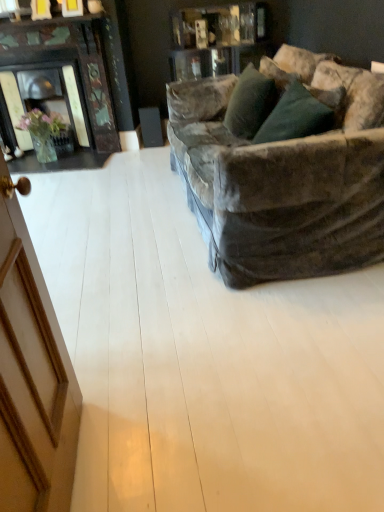
Question: Considering the relative sizes of velvet green pillow at upper right and light wood floor at center in the image provided, is velvet green pillow at upper right taller than light wood floor at center?

Choices:
 (A) yes
 (B) no

Answer: (A)

Question: Is velvet green pillow at upper right closer to camera compared to light wood floor at center?

Choices:
 (A) no
 (B) yes

Answer: (A)

Question: From the image's perspective, is velvet green pillow at upper right beneath light wood floor at center?

Choices:
 (A) yes
 (B) no

Answer: (B)

Question: Considering the relative sizes of velvet green pillow at upper right and light wood floor at center in the image provided, is velvet green pillow at upper right smaller than light wood floor at center?

Choices:
 (A) no
 (B) yes

Answer: (B)

Question: Does velvet green pillow at upper right have a lesser height compared to light wood floor at center?

Choices:
 (A) yes
 (B) no

Answer: (B)

Question: From the image's perspective, does velvet green pillow at upper right appear higher than light wood floor at center?

Choices:
 (A) yes
 (B) no

Answer: (A)

Question: Is light wood floor at center outside of velvet green pillow at upper right?

Choices:
 (A) yes
 (B) no

Answer: (A)

Question: Is light wood floor at center wider than velvet green pillow at upper right?

Choices:
 (A) no
 (B) yes

Answer: (B)

Question: Is light wood floor at center to the left of velvet green pillow at upper right from the viewer's perspective?

Choices:
 (A) no
 (B) yes

Answer: (B)

Question: Considering the relative sizes of light wood floor at center and velvet green pillow at upper right in the image provided, is light wood floor at center taller than velvet green pillow at upper right?

Choices:
 (A) no
 (B) yes

Answer: (A)

Question: Is light wood floor at center oriented away from velvet green pillow at upper right?

Choices:
 (A) yes
 (B) no

Answer: (B)

Question: From a real-world perspective, is light wood floor at center under velvet green pillow at upper right?

Choices:
 (A) no
 (B) yes

Answer: (B)

Question: Considering the relative positions of light wood floor at center and velvet green pillow at upper right in the image provided, is light wood floor at center to the left or to the right of velvet green pillow at upper right?

Choices:
 (A) left
 (B) right

Answer: (A)